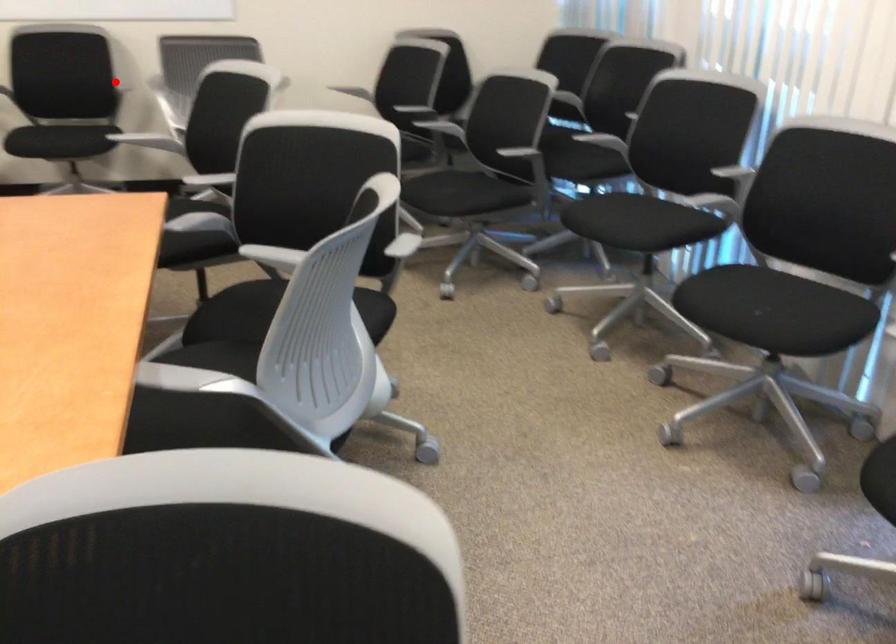
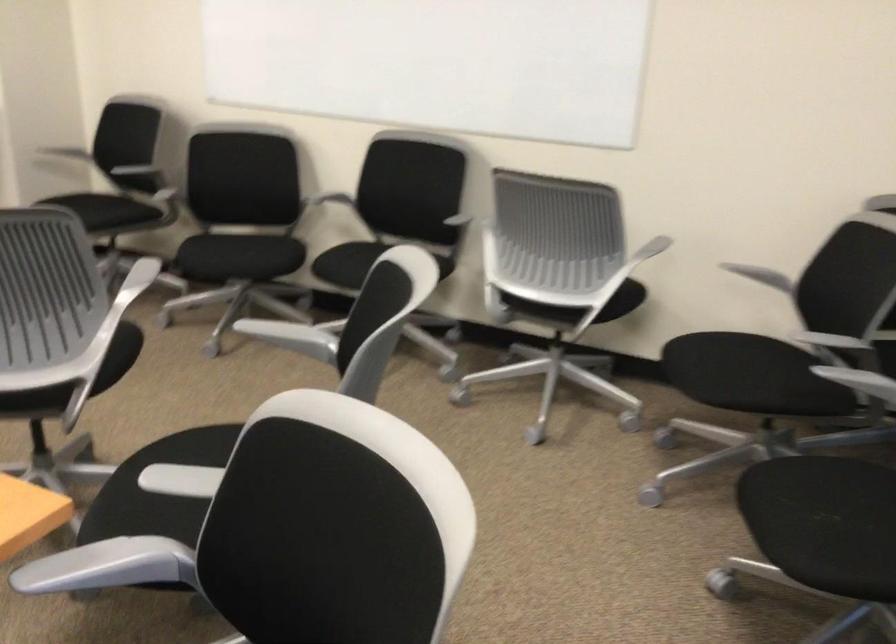
Locate, in the second image, the point that corresponds to the highlighted location in the first image.

(469, 207)